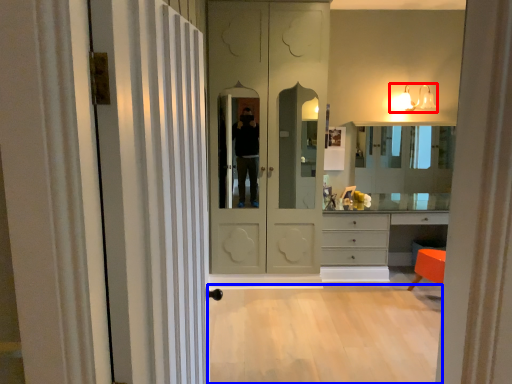
Question: Which of the following is the closest to the observer, light fixture (highlighted by a red box) or plain (highlighted by a blue box)?

Choices:
 (A) light fixture
 (B) plain

Answer: (B)